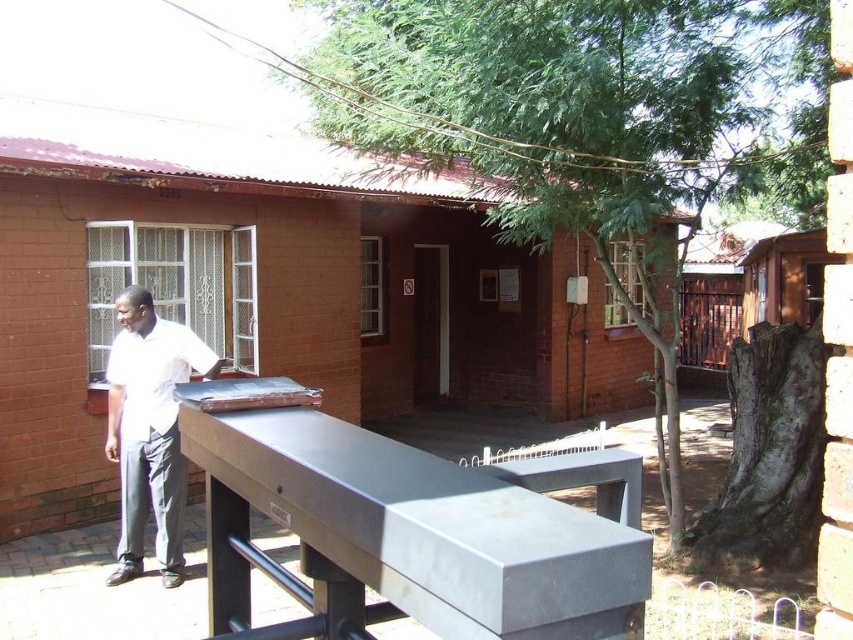
You are standing in front of a brick building with a red corrugated metal roof. There is a smooth gray picnic table at center. If you want to place a 30 inch long object on the table, will it fit? Please consider the distance between you and the table.

The distance between the smooth gray picnic table at center and the viewer is 29.10 inches. Since the object is 30 inches long, it may not fit entirely on the table as the distance is slightly shorter than the object.